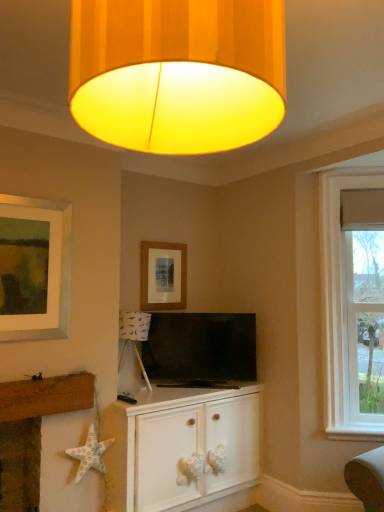
Image resolution: width=384 pixels, height=512 pixels. Describe the element at coordinates (201, 350) in the screenshot. I see `black glossy flat-screen tv at center` at that location.

This screenshot has height=512, width=384. In order to click on white paper starfish at lower left in this screenshot , I will do `click(90, 454)`.

Describe the element at coordinates (163, 276) in the screenshot. I see `matte wooden picture frame at upper center` at that location.

In order to face yellow fabric lampshade at upper center, should I rotate leftwards or rightwards?

To align with it, rotate left about 2.103°.

The image size is (384, 512). Describe the element at coordinates (338, 296) in the screenshot. I see `clear glass window at right` at that location.

At what (x,y) coordinates should I click in order to perform the action: click on black glossy flat-screen tv at center. Please return your answer as a coordinate pair (x, y). The height and width of the screenshot is (512, 384). Looking at the image, I should click on (201, 350).

Considering the positions of objects white fabric starfish at lower left and matte wooden picture frame at upper center in the image provided, who is behind, white fabric starfish at lower left or matte wooden picture frame at upper center?

matte wooden picture frame at upper center is behind.

Considering the points (35, 468) and (175, 279), which point is in front, point (35, 468) or point (175, 279)?

The point (35, 468) is closer.

Which is more to the left, white fabric starfish at lower left or matte wooden picture frame at upper center?

white fabric starfish at lower left.

Is white fabric starfish at lower left oriented towards matte wooden picture frame at upper center?

No, white fabric starfish at lower left is not turned towards matte wooden picture frame at upper center.

Between yellow fabric lampshade at upper center and matte wooden picture frame at upper center, which one has less height?

yellow fabric lampshade at upper center is shorter.

Measure the distance between yellow fabric lampshade at upper center and matte wooden picture frame at upper center.

yellow fabric lampshade at upper center and matte wooden picture frame at upper center are 2.70 meters apart from each other.

How many degrees apart are the facing directions of yellow fabric lampshade at upper center and matte wooden picture frame at upper center?

The angle between the facing direction of yellow fabric lampshade at upper center and the facing direction of matte wooden picture frame at upper center is 91.5 degrees.

Relative to matte wooden picture frame at upper center, is yellow fabric lampshade at upper center in front or behind?

yellow fabric lampshade at upper center is positioned closer to the viewer than matte wooden picture frame at upper center.

Which is closer to the camera, (189, 434) or (91, 440)?

The point (91, 440) is closer.

From a real-world perspective, is white wood cabinet at center above or below white paper starfish at lower left?

From a real-world perspective, white wood cabinet at center is physically below white paper starfish at lower left.

Is white wood cabinet at center not near white paper starfish at lower left?

No, there isn't a large distance between white wood cabinet at center and white paper starfish at lower left.

Considering the sizes of objects white wood cabinet at center and white paper starfish at lower left in the image provided, who is taller, white wood cabinet at center or white paper starfish at lower left?

With more height is white wood cabinet at center.

Are yellow fabric lampshade at upper center and black glossy flat-screen tv at center far apart?

Indeed, yellow fabric lampshade at upper center is not near black glossy flat-screen tv at center.

From the image's perspective, which is below, yellow fabric lampshade at upper center or black glossy flat-screen tv at center?

black glossy flat-screen tv at center appears lower in the image.

Who is shorter, yellow fabric lampshade at upper center or black glossy flat-screen tv at center?

Standing shorter between the two is yellow fabric lampshade at upper center.

What's the angular difference between clear glass window at right and white wood cabinet at center's facing directions?

The angle between the facing direction of clear glass window at right and the facing direction of white wood cabinet at center is 42.4 degrees.

From a real-world perspective, is clear glass window at right physically located above or below white wood cabinet at center?

clear glass window at right is situated higher than white wood cabinet at center in the real world.

Would you say clear glass window at right is outside white wood cabinet at center?

Yes, clear glass window at right is not within white wood cabinet at center.

In the image, there is a clear glass window at right. Where is `cabinetry below it (from the image's perspective)`? This screenshot has width=384, height=512. cabinetry below it (from the image's perspective) is located at coordinates (181, 446).

Between white fabric starfish at lower left and white wood cabinet at center, which one has larger size?

Bigger between the two is white wood cabinet at center.

From the image's perspective, relative to white wood cabinet at center, is white fabric starfish at lower left above or below?

white fabric starfish at lower left is situated higher than white wood cabinet at center in the image.

Which is behind, point (31, 399) or point (134, 507)?

The point (134, 507) is behind.

Does clear glass window at right turn towards matte wooden picture frame at upper center?

No, clear glass window at right is not oriented towards matte wooden picture frame at upper center.

Is clear glass window at right wider than matte wooden picture frame at upper center?

Correct, the width of clear glass window at right exceeds that of matte wooden picture frame at upper center.

Considering the relative sizes of clear glass window at right and matte wooden picture frame at upper center in the image provided, is clear glass window at right taller than matte wooden picture frame at upper center?

Yes.

Would you consider clear glass window at right to be distant from matte wooden picture frame at upper center?

Yes, clear glass window at right and matte wooden picture frame at upper center are located far from each other.

The height and width of the screenshot is (512, 384). What are the coordinates of `fireplace that appears below the matte wooden picture frame at upper center (from a real-world perspective)` in the screenshot? It's located at (33, 431).

The width and height of the screenshot is (384, 512). I want to click on picture frame on the left side of yellow fabric lampshade at upper center, so click(163, 276).

Looking at the image, which one is located further to yellow fabric lampshade at upper center, white wood cabinet at center or matte wooden picture frame at upper center?

matte wooden picture frame at upper center is positioned further to the anchor yellow fabric lampshade at upper center.

Considering their positions, is matte wooden picture frame at upper center positioned further to black glossy flat-screen tv at center than white fabric starfish at lower left?

Among the two, white fabric starfish at lower left is located further to black glossy flat-screen tv at center.

Based on the photo, considering their positions, is white fabric starfish at lower left positioned further to yellow fabric lampshade at upper center than white paper starfish at lower left?

white fabric starfish at lower left is positioned further to the anchor yellow fabric lampshade at upper center.

Based on their spatial positions, is white fabric starfish at lower left or matte wooden picture frame at upper center further from white paper starfish at lower left?

Among the two, matte wooden picture frame at upper center is located further to white paper starfish at lower left.

Looking at the image, which one is located closer to clear glass window at right, black glossy flat-screen tv at center or matte wooden picture frame at upper center?

Based on the image, black glossy flat-screen tv at center appears to be nearer to clear glass window at right.

From the image, which object appears to be nearer to white paper starfish at lower left, white wood cabinet at center or matte wooden picture frame at upper center?

The object closer to white paper starfish at lower left is white wood cabinet at center.

Looking at the image, which one is located closer to white fabric starfish at lower left, matte wooden picture frame at upper center or white paper starfish at lower left?

Among the two, white paper starfish at lower left is located nearer to white fabric starfish at lower left.

Looking at the image, which one is located further to matte wooden picture frame at upper center, yellow fabric lampshade at upper center or white fabric starfish at lower left?

yellow fabric lampshade at upper center.

Find the location of a particular element. Image resolution: width=384 pixels, height=512 pixels. television situated between white wood cabinet at center and clear glass window at right from left to right is located at coordinates (201, 350).

Locate an element on the screen. starfish between yellow fabric lampshade at upper center and black glossy flat-screen tv at center from front to back is located at coordinates (90, 454).

Identify the location of television located between white paper starfish at lower left and clear glass window at right in the left-right direction. (201, 350).

Locate an element on the screen. The height and width of the screenshot is (512, 384). starfish located between yellow fabric lampshade at upper center and clear glass window at right in the depth direction is located at coordinates (90, 454).